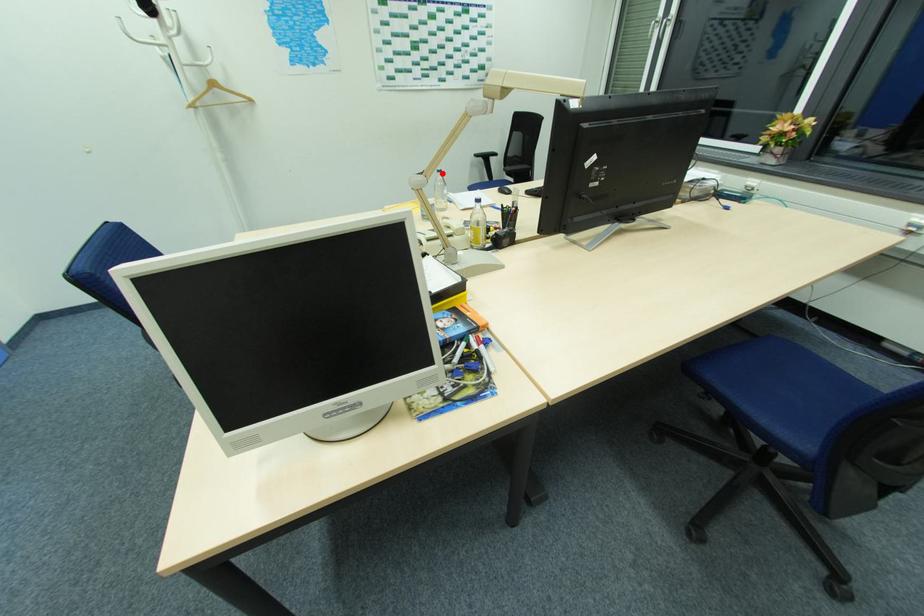
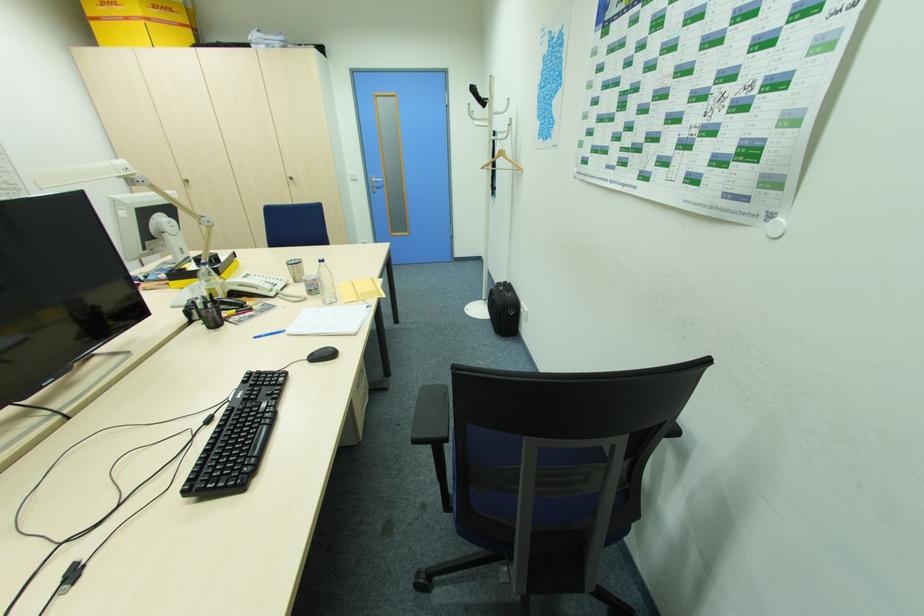
Locate, in the second image, the point that corresponds to the highlighted location in the first image.

(324, 264)